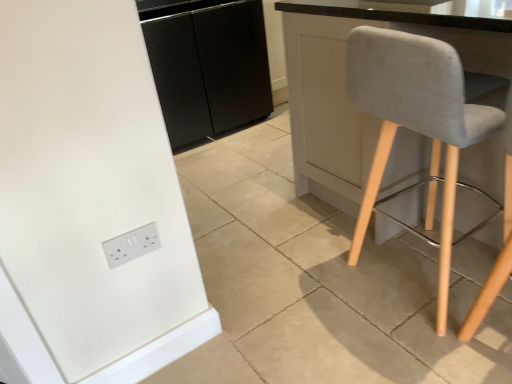
Question: In terms of width, does white plastic socket at lower left look wider or thinner when compared to light gray fabric chair at right?

Choices:
 (A) wide
 (B) thin

Answer: (B)

Question: Is white plastic socket at lower left bigger or smaller than light gray fabric chair at right?

Choices:
 (A) small
 (B) big

Answer: (A)

Question: Which of these objects is positioned closest to the light gray fabric chair at right?

Choices:
 (A) black matte cabinet at center
 (B) white plastic socket at lower left

Answer: (B)

Question: Which object is positioned closest to the black matte cabinet at center?

Choices:
 (A) white plastic socket at lower left
 (B) light gray fabric chair at right

Answer: (B)